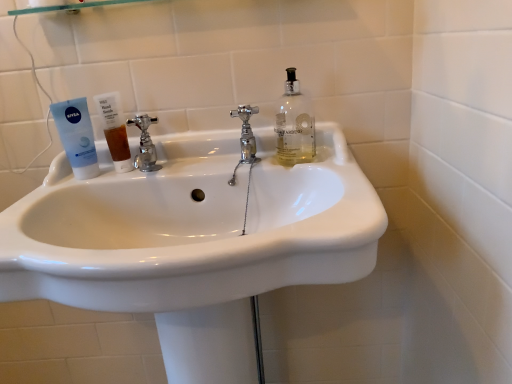
Question: Can you confirm if brown translucent liquid at sink left is positioned to the right of polished chrome faucet at center, the first tap from the left?

Choices:
 (A) yes
 (B) no

Answer: (B)

Question: From the image's perspective, is brown translucent liquid at sink left below polished chrome faucet at center, the 2th tap in the right-to-left sequence?

Choices:
 (A) yes
 (B) no

Answer: (A)

Question: Is polished chrome faucet at center, the 2th tap in the right-to-left sequence, at the back of brown translucent liquid at sink left?

Choices:
 (A) no
 (B) yes

Answer: (A)

Question: From the image's perspective, is brown translucent liquid at sink left over polished chrome faucet at center, the first tap from the left?

Choices:
 (A) no
 (B) yes

Answer: (A)

Question: Considering the relative sizes of brown translucent liquid at sink left and polished chrome faucet at center, the 2th tap in the right-to-left sequence, in the image provided, is brown translucent liquid at sink left wider than polished chrome faucet at center, the 2th tap in the right-to-left sequence,?

Choices:
 (A) yes
 (B) no

Answer: (B)

Question: Is polished chrome faucet at center, acting as the 2th tap starting from the left, situated inside white glossy sink at center or outside?

Choices:
 (A) outside
 (B) inside

Answer: (B)

Question: Would you say polished chrome faucet at center, arranged as the 1th tap when viewed from the right, is to the left or to the right of white glossy sink at center in the picture?

Choices:
 (A) left
 (B) right

Answer: (B)

Question: Is point (230, 114) closer or farther from the camera than point (189, 243)?

Choices:
 (A) closer
 (B) farther

Answer: (B)

Question: In terms of size, does polished chrome faucet at center, arranged as the 1th tap when viewed from the right, appear bigger or smaller than white glossy sink at center?

Choices:
 (A) small
 (B) big

Answer: (A)

Question: Is white glossy sink at center taller or shorter than brown translucent liquid at sink left?

Choices:
 (A) short
 (B) tall

Answer: (B)

Question: Which is correct: white glossy sink at center is inside brown translucent liquid at sink left, or outside of it?

Choices:
 (A) outside
 (B) inside

Answer: (A)

Question: Considering the positions of white glossy sink at center and brown translucent liquid at sink left in the image, is white glossy sink at center bigger or smaller than brown translucent liquid at sink left?

Choices:
 (A) big
 (B) small

Answer: (A)

Question: Is white glossy sink at center wider or thinner than brown translucent liquid at sink left?

Choices:
 (A) thin
 (B) wide

Answer: (B)

Question: Would you say brown translucent liquid at sink left is to the left or to the right of white glossy sink at center in the picture?

Choices:
 (A) right
 (B) left

Answer: (B)

Question: In terms of width, does brown translucent liquid at sink left look wider or thinner when compared to white glossy sink at center?

Choices:
 (A) thin
 (B) wide

Answer: (A)